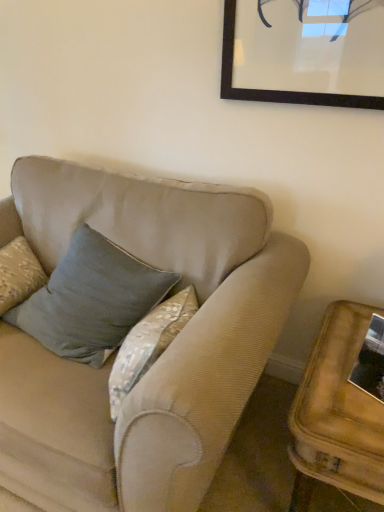
What are the coordinates of `vacant space situated on the left part of metallic reflective frame at lower right` in the screenshot? It's located at (329, 386).